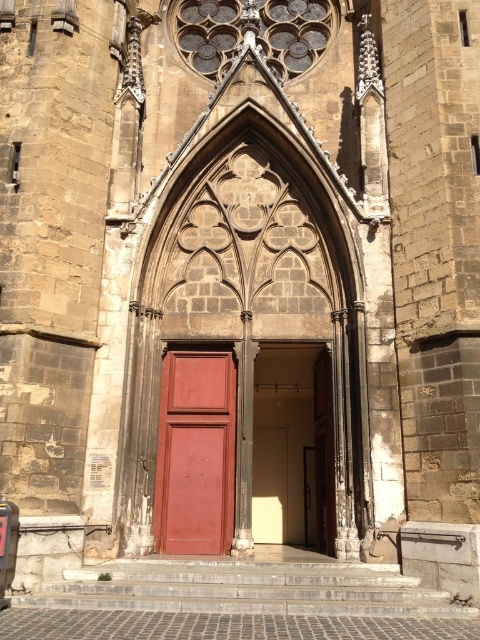
Question: Does gray stone stairs at lower center have a lesser width compared to smooth cream door at center?

Choices:
 (A) no
 (B) yes

Answer: (A)

Question: Which of the following is the closest to the observer?

Choices:
 (A) matte wood door at center
 (B) smooth cream door at center
 (C) gray stone stairs at lower center

Answer: (C)

Question: Estimate the real-world distances between objects in this image. Which object is farther from the gray stone stairs at lower center?

Choices:
 (A) smooth cream door at center
 (B) matte wood door at center

Answer: (A)

Question: Does smooth cream door at center have a lesser width compared to matte wood door at center?

Choices:
 (A) yes
 (B) no

Answer: (B)

Question: Among these objects, which one is nearest to the camera?

Choices:
 (A) smooth cream door at center
 (B) gray stone stairs at lower center

Answer: (B)

Question: Can you confirm if gray stone stairs at lower center is bigger than smooth cream door at center?

Choices:
 (A) yes
 (B) no

Answer: (B)